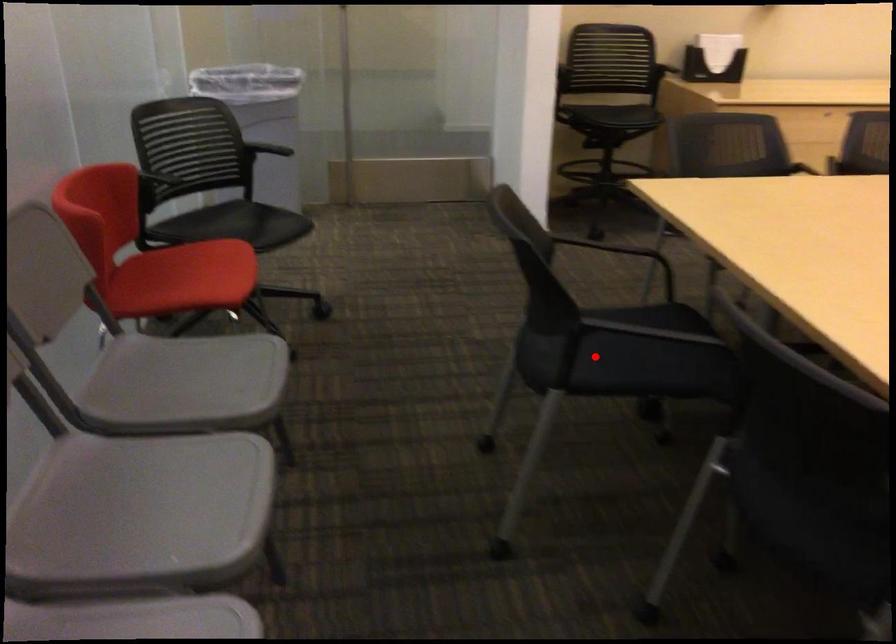
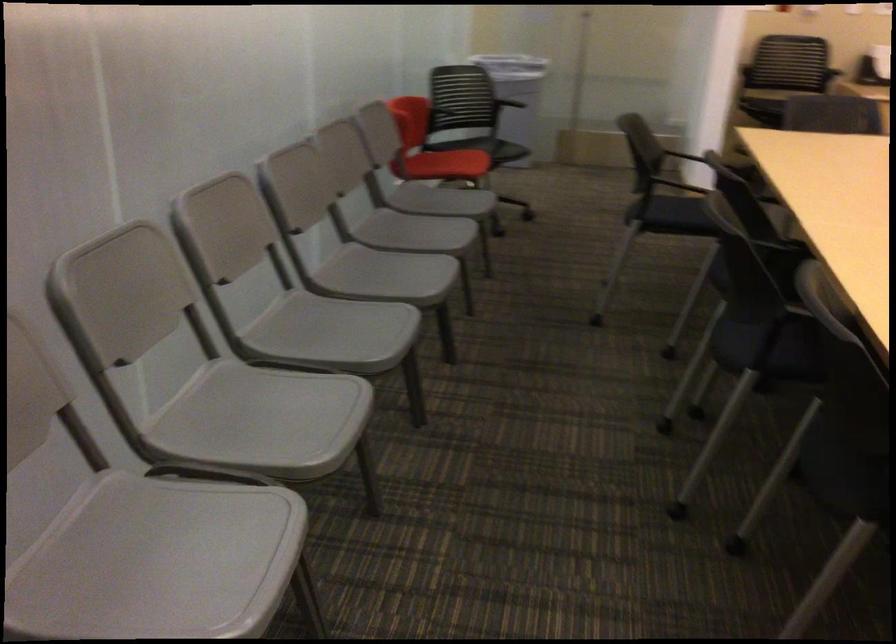
Question: I am providing you with two images of the same scene from different viewpoints. In image1, a red point is highlighted. Considering the same 3D point in image2, which of the following is correct?

Choices:
 (A) It is closer
 (B) It is farther

Answer: (B)